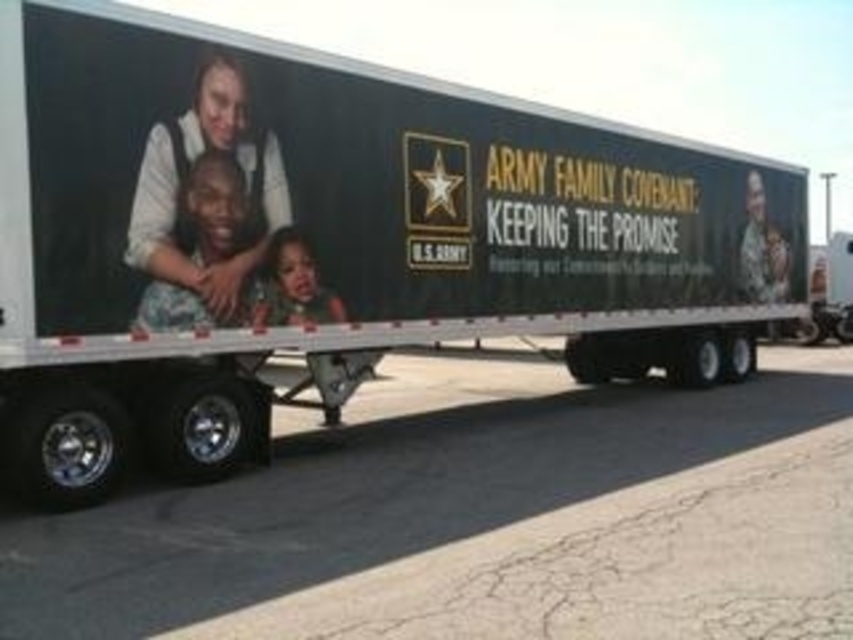
What do you see at coordinates (216, 211) in the screenshot? The image size is (853, 640). I see `matte black uniform at center` at bounding box center [216, 211].

Does matte black uniform at center appear on the left side of smooth skin child at center?

Yes, matte black uniform at center is to the left of smooth skin child at center.

Image resolution: width=853 pixels, height=640 pixels. Identify the location of matte black uniform at center. (216, 211).

Find the location of a particular element. Image resolution: width=853 pixels, height=640 pixels. matte black uniform at center is located at coordinates (216, 211).